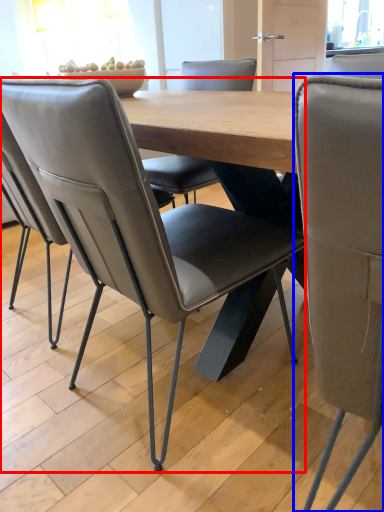
Question: Which object appears closest to the camera in this image, chair (highlighted by a red box) or chair (highlighted by a blue box)?

Choices:
 (A) chair
 (B) chair

Answer: (B)